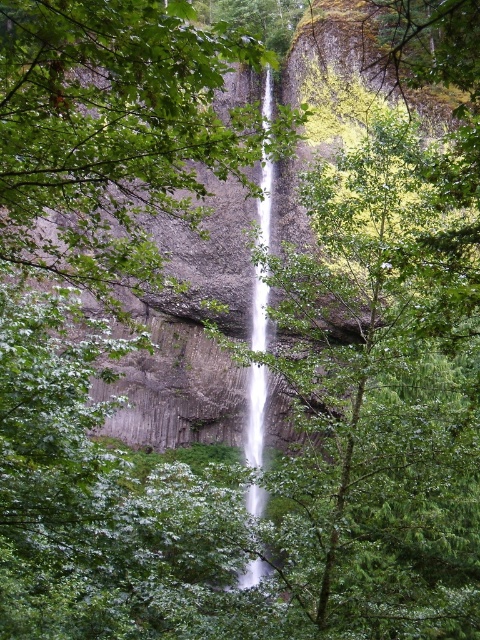
Is green leafy tree at center bigger than white smooth waterfall at center?

Indeed, green leafy tree at center has a larger size compared to white smooth waterfall at center.

Measure the distance between green leafy tree at center and camera.

green leafy tree at center and camera are 8.50 meters apart.

You are a GUI agent. You are given a task and a screenshot of the screen. Output one action in this format:
    pyautogui.click(x=<x>, y=<y>)
    Task: Click on the green leafy tree at center
    Image resolution: width=480 pixels, height=640 pixels.
    Given the screenshot: What is the action you would take?
    pyautogui.click(x=111, y=131)